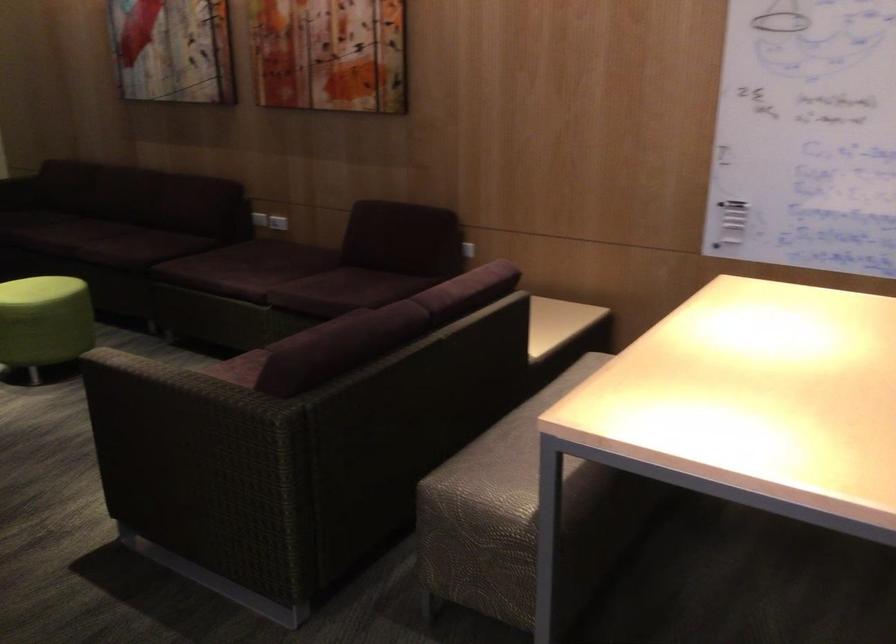
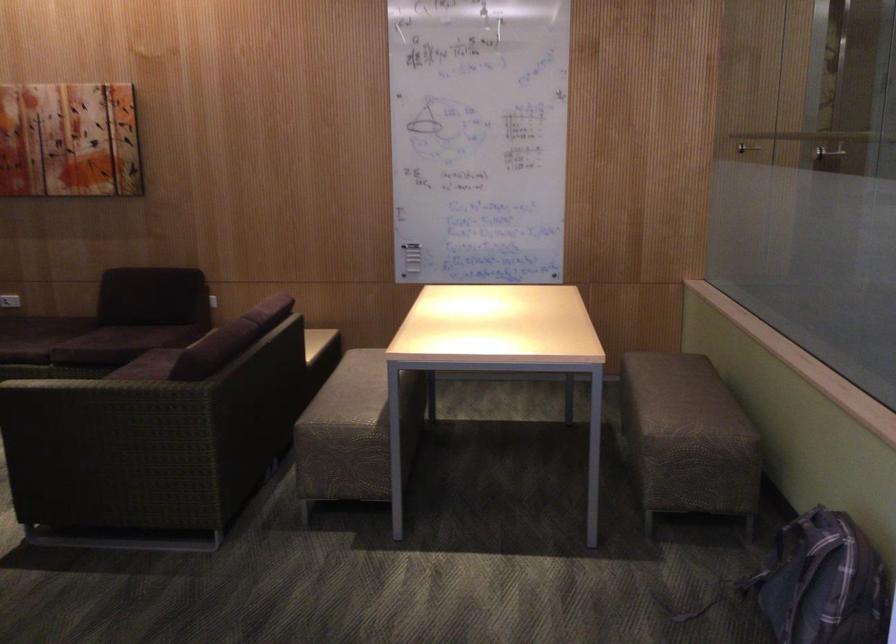
The point at (366, 270) is marked in the first image. Where is the corresponding point in the second image?

(123, 322)